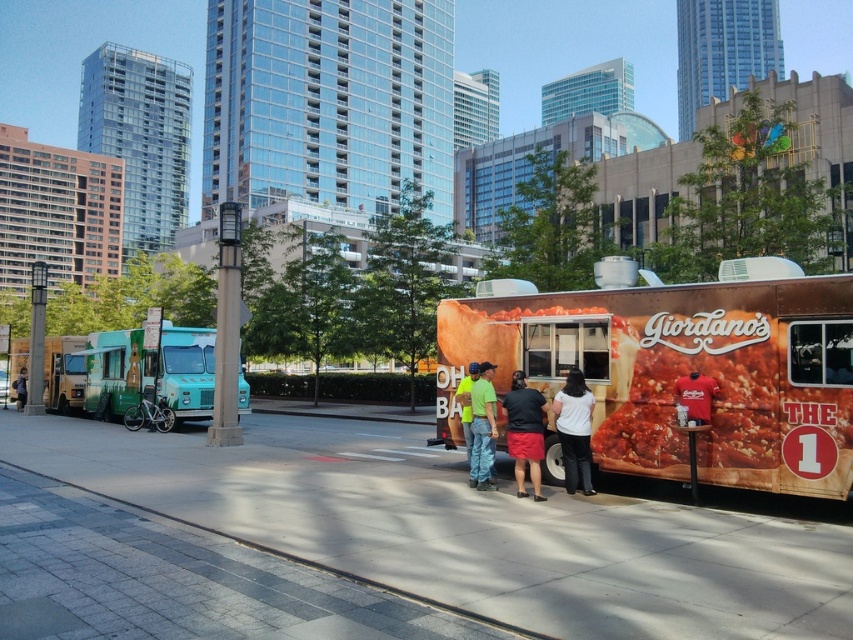
Which is in front, point (498, 545) or point (486, 428)?

Point (498, 545) is in front.

Who is shorter, gray concrete sidewalk at center or green fabric shirt at center?

gray concrete sidewalk at center is shorter.

Is point (401, 564) positioned after point (477, 381)?

No, (401, 564) is closer to viewer.

The height and width of the screenshot is (640, 853). What are the coordinates of `gray concrete sidewalk at center` in the screenshot? It's located at (471, 529).

Between matte white food truck at left and green fabric shirt at center, which one is positioned lower?

green fabric shirt at center is below.

Which is above, matte white food truck at left or green fabric shirt at center?

matte white food truck at left is higher up.

What are the coordinates of `matte white food truck at left` in the screenshot? It's located at (62, 372).

Is matte orange food truck at center taller than matte white food truck at left?

Incorrect, matte orange food truck at center's height is not larger of matte white food truck at left's.

This screenshot has height=640, width=853. I want to click on matte orange food truck at center, so click(682, 369).

Where is `matte orange food truck at center`? Image resolution: width=853 pixels, height=640 pixels. matte orange food truck at center is located at coordinates (682, 369).